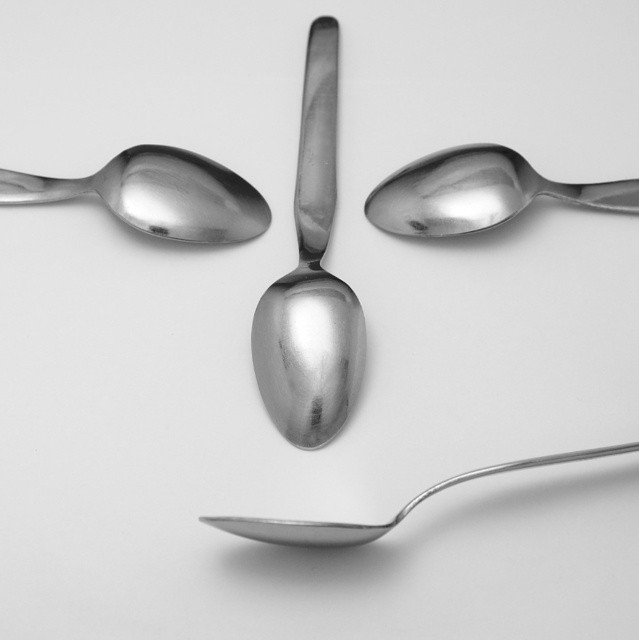
Where is `polished metal spoon at upper center`? The image size is (639, 640). polished metal spoon at upper center is located at coordinates 477,193.

In the scene shown: Measure the distance between polished metal spoon at upper center and polished metal spoon at bottom.

polished metal spoon at upper center and polished metal spoon at bottom are 22.06 inches apart from each other.

Who is more forward, (603, 189) or (631, 444)?

Point (631, 444) is more forward.

In order to click on polished metal spoon at upper center in this screenshot , I will do `click(477, 193)`.

Based on the photo, is polished metal spoon at left smaller than polished metal spoon at bottom?

Yes.

Does polished metal spoon at left appear over polished metal spoon at bottom?

Yes.

The height and width of the screenshot is (640, 639). Find the location of `polished metal spoon at left`. polished metal spoon at left is located at coordinates (158, 195).

Does polished metal spoon at center appear on the left side of polished metal spoon at bottom?

Correct, you'll find polished metal spoon at center to the left of polished metal spoon at bottom.

Is polished metal spoon at center above polished metal spoon at bottom?

Indeed, polished metal spoon at center is positioned over polished metal spoon at bottom.

This screenshot has height=640, width=639. Describe the element at coordinates (311, 282) in the screenshot. I see `polished metal spoon at center` at that location.

At what (x,y) coordinates should I click in order to perform the action: click on polished metal spoon at center. Please return your answer as a coordinate pair (x, y). Image resolution: width=639 pixels, height=640 pixels. Looking at the image, I should click on (311, 282).